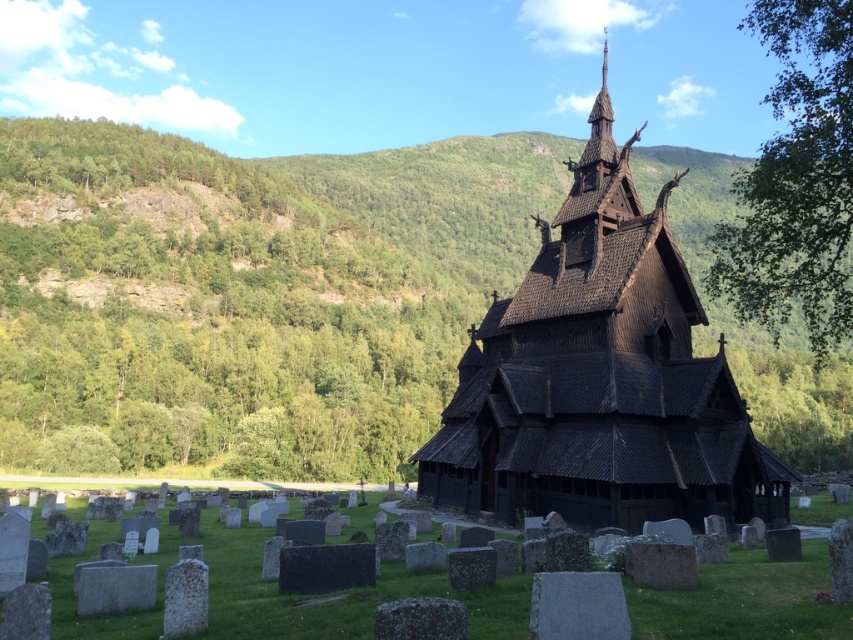
You are standing in front of the traditional Norwegian stave church and notice the green leafy hillside at upper left. Based on its position, can you determine if it is closer to the church or further away from it?

The green leafy hillside at upper left is located at point (248, 291), which places it further away from the church compared to the gravestones in the foreground.